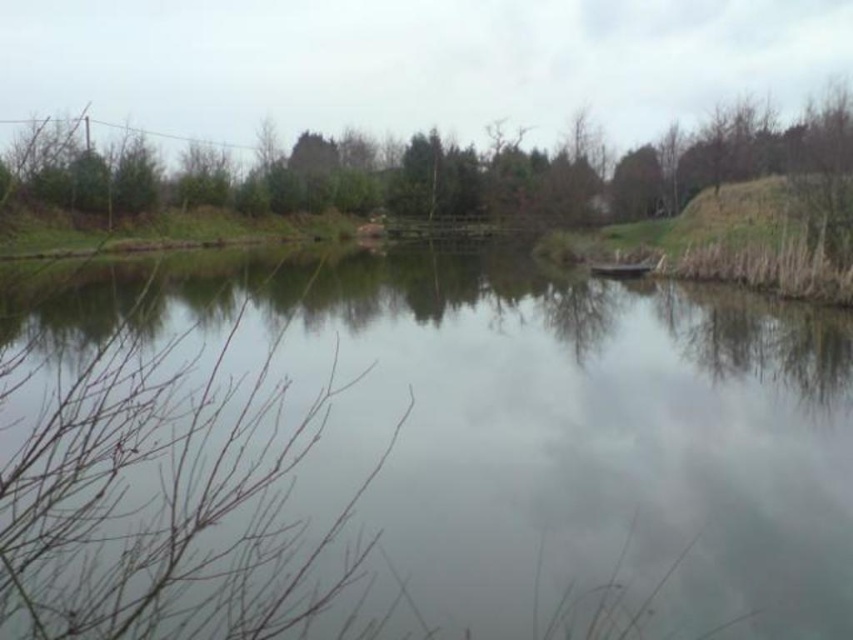
You are standing at the edge of the pond and want to place two markers at the coordinates point (708, 512) and point (410, 172). Which marker will appear closer to you in the image?

Point (708, 512) is closer to the camera than point (410, 172), so the marker at point (708, 512) will appear closer to you in the image.

You are standing at the edge of the pond and want to take a photo that includes both the transparent water at center and the green leafy tree at upper center. Which object will appear larger in your photo?

The transparent water at center will appear larger in the photo because it is closer to the viewer than the green leafy tree at upper center.